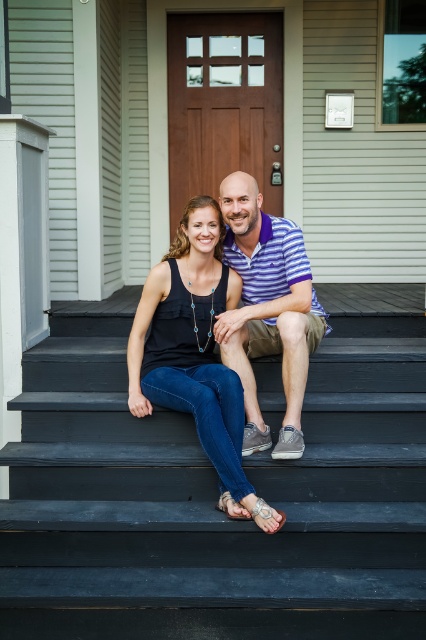
Between point (357, 440) and point (236, 513), which one is positioned behind?

The point (357, 440) is more distant.

I want to click on smooth black stairs at center, so click(x=213, y=500).

The width and height of the screenshot is (426, 640). What do you see at coordinates (213, 500) in the screenshot?
I see `smooth black stairs at center` at bounding box center [213, 500].

Locate an element on the screen. smooth black stairs at center is located at coordinates (213, 500).

Is matte black tank top at center taller than striped cotton polo shirt at center?

Yes, matte black tank top at center is taller than striped cotton polo shirt at center.

Is the position of matte black tank top at center more distant than that of striped cotton polo shirt at center?

No.

I want to click on matte black tank top at center, so click(x=195, y=353).

This screenshot has height=640, width=426. Find the location of `matte black tank top at center`. matte black tank top at center is located at coordinates (195, 353).

Who is lower down, smooth black stairs at center or striped cotton polo shirt at center?

smooth black stairs at center is lower down.

Does smooth black stairs at center appear on the right side of striped cotton polo shirt at center?

Incorrect, smooth black stairs at center is not on the right side of striped cotton polo shirt at center.

Is point (331, 337) more distant than point (255, 330)?

Yes.

Locate an element on the screen. smooth black stairs at center is located at coordinates (213, 500).